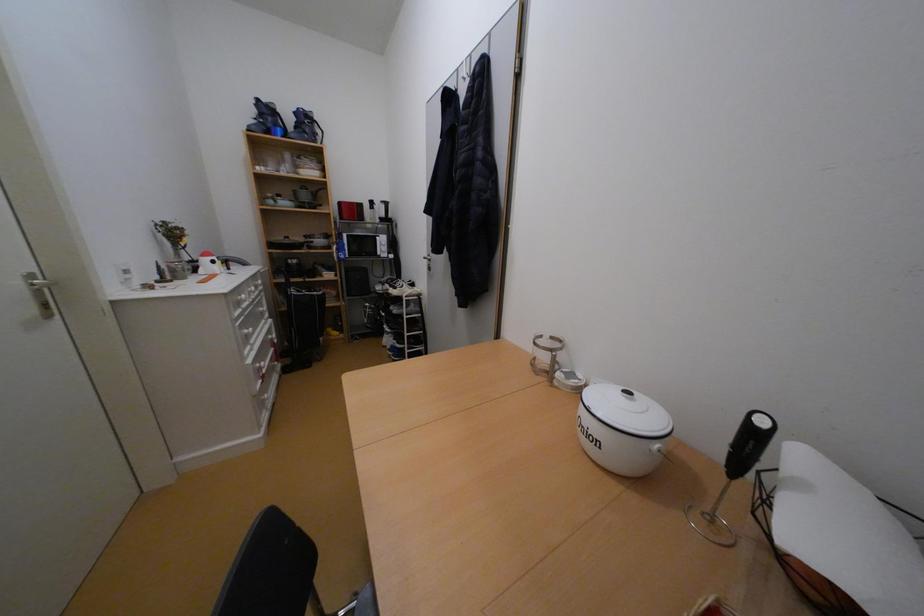
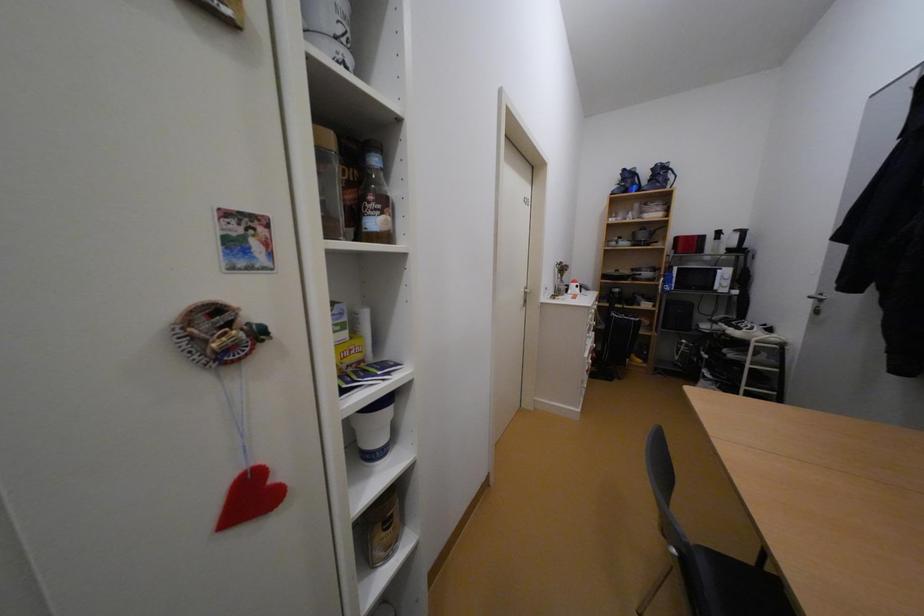
Question: The camera is either moving clockwise (left) or counter-clockwise (right) around the object. The first image is from the beginning of the video and the second image is from the end. Is the camera moving left or right when shooting the video?

Choices:
 (A) Left
 (B) Right

Answer: (B)